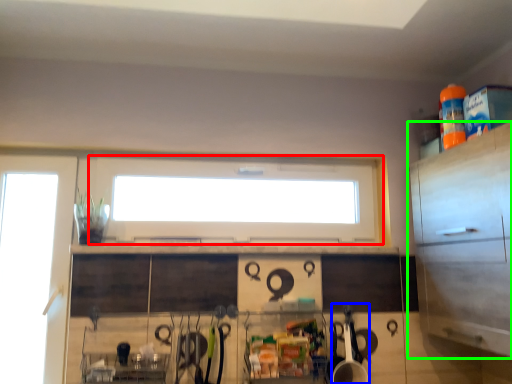
Question: Estimate the real-world distances between objects in this image. Which object is closer to window (highlighted by a red box), appliance (highlighted by a blue box) or cabinetry (highlighted by a green box)?

Choices:
 (A) appliance
 (B) cabinetry

Answer: (A)